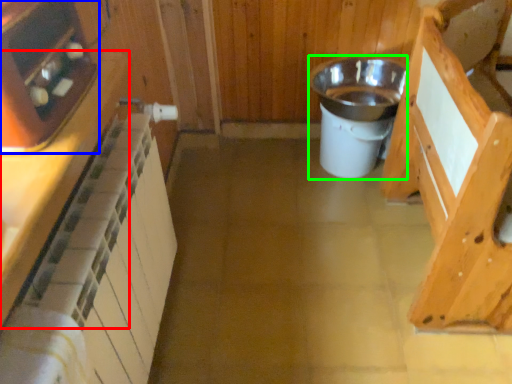
Question: Considering the real-world distances, which object is closest to cabinetry (highlighted by a red box)? appliance (highlighted by a blue box) or appliance (highlighted by a green box).

Choices:
 (A) appliance
 (B) appliance

Answer: (A)